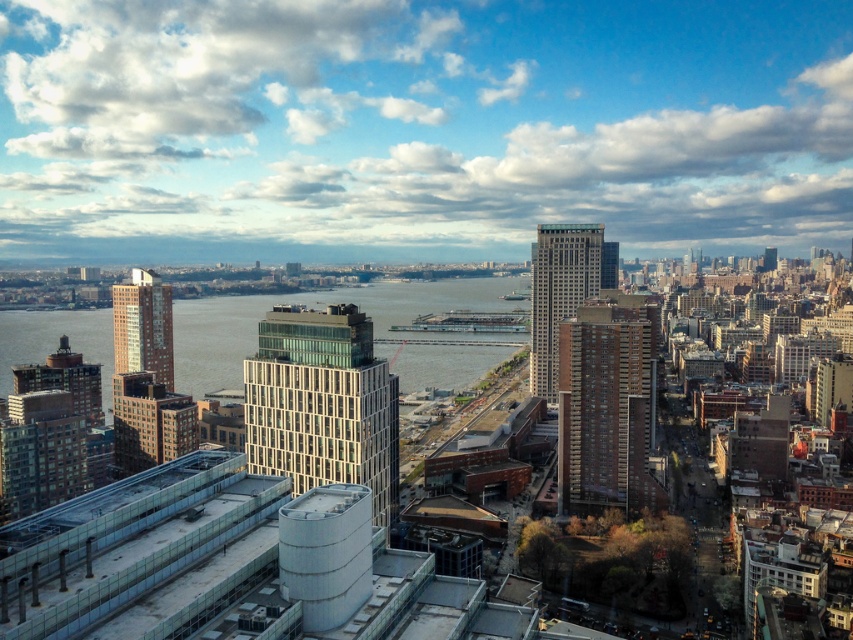
You are a city planner analyzing the urban layout. Given the clear blue water at center and the glassy steel skyscraper at center, which one spans a greater horizontal distance across the image?

The clear blue water at center spans a greater horizontal distance across the image because its width surpasses that of the glassy steel skyscraper at center.